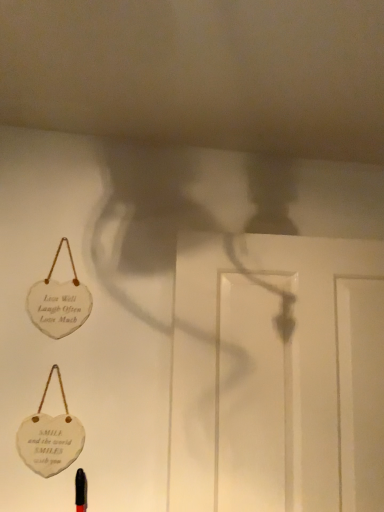
Describe the element at coordinates (58, 306) in the screenshot. I see `white wood heart at upper left` at that location.

At what (x,y) coordinates should I click in order to perform the action: click on white wood heart at upper left. Please return your answer as a coordinate pair (x, y). Looking at the image, I should click on click(x=58, y=306).

The image size is (384, 512). I want to click on white glossy door at center, so click(277, 374).

Image resolution: width=384 pixels, height=512 pixels. What do you see at coordinates (277, 374) in the screenshot?
I see `white glossy door at center` at bounding box center [277, 374].

In order to face white glossy door at center, should I rotate leftwards or rightwards?

It's best to rotate right around 13.168 degrees.

The height and width of the screenshot is (512, 384). I want to click on white wood heart at upper left, so click(58, 306).

Considering the relative positions of white glossy door at center and white wood heart at upper left in the image provided, is white glossy door at center to the left or to the right of white wood heart at upper left?

Clearly, white glossy door at center is on the right of white wood heart at upper left in the image.

Which object is more forward, white glossy door at center or white wood heart at upper left?

white glossy door at center is closer to the camera.

Is point (297, 335) positioned after point (80, 325)?

No, it is not.

From the image's perspective, which one is positioned lower, white glossy door at center or white wood heart at upper left?

white glossy door at center appears lower in the image.

From a real-world perspective, is white glossy door at center physically located above or below white wood heart at upper left?

Clearly, from a real-world perspective, white glossy door at center is below white wood heart at upper left.

Can you confirm if white glossy door at center is thinner than white wood heart at upper left?

No.

Does white glossy door at center have a greater height compared to white wood heart at upper left?

Yes.

Considering the relative sizes of white glossy door at center and white wood heart at upper left in the image provided, is white glossy door at center smaller than white wood heart at upper left?

No, white glossy door at center is not smaller than white wood heart at upper left.

Is white glossy door at center outside of white wood heart at upper left?

Absolutely, white glossy door at center is external to white wood heart at upper left.

Is white glossy door at center far away from white wood heart at upper left?

That's not correct — white glossy door at center is a little close to white wood heart at upper left.

Is white glossy door at center turned away from white wood heart at upper left?

No, white wood heart at upper left is not at the back of white glossy door at center.

Can you tell me how much white glossy door at center and white wood heart at upper left differ in facing direction?

There is a 1.51-degree angle between the facing directions of white glossy door at center and white wood heart at upper left.

How much distance is there between white glossy door at center and white wood heart at upper left?

white glossy door at center is 22.38 inches from white wood heart at upper left.

Locate an element on the screen. This screenshot has height=512, width=384. door beneath the white wood heart at upper left (from a real-world perspective) is located at coordinates (277, 374).

Is white wood heart at upper left at the left side of white glossy door at center?

Correct, you'll find white wood heart at upper left to the left of white glossy door at center.

Considering their positions, is white wood heart at upper left located in front of or behind white glossy door at center?

white wood heart at upper left is positioned farther from the viewer than white glossy door at center.

Which is less distant, (55,303) or (228,395)?

Point (55,303) appears to be farther away from the viewer than point (228,395).

Looking at this image, from the image's perspective, who appears lower, white wood heart at upper left or white glossy door at center?

From the image's view, white glossy door at center is below.

From a real-world perspective, is white wood heart at upper left located beneath white glossy door at center?

Actually, white wood heart at upper left is physically above white glossy door at center in the real world.

In terms of width, does white wood heart at upper left look wider or thinner when compared to white glossy door at center?

Clearly, white wood heart at upper left has less width compared to white glossy door at center.

Which of these two, white wood heart at upper left or white glossy door at center, stands shorter?

With less height is white wood heart at upper left.

Considering the sizes of objects white wood heart at upper left and white glossy door at center in the image provided, who is bigger, white wood heart at upper left or white glossy door at center?

white glossy door at center.

Is white glossy door at center a part of white wood heart at upper left?

Definitely not — white glossy door at center is not inside white wood heart at upper left.

Is white wood heart at upper left next to white glossy door at center and touching it?

white wood heart at upper left and white glossy door at center are not in contact.

Is white wood heart at upper left turned away from white glossy door at center?

white wood heart at upper left does not have its back to white glossy door at center.

Consider the image. How different are the orientations of white wood heart at upper left and white glossy door at center in degrees?

There is a 1.51-degree angle between the facing directions of white wood heart at upper left and white glossy door at center.

Where is `badge above the white glossy door at center (from a real-world perspective)`? The width and height of the screenshot is (384, 512). badge above the white glossy door at center (from a real-world perspective) is located at coordinates (58, 306).

In the image, there is a white wood heart at upper left. Identify the location of door below it (from a real-world perspective). The height and width of the screenshot is (512, 384). (277, 374).

This screenshot has height=512, width=384. I want to click on badge that appears above the white glossy door at center (from the image's perspective), so click(x=58, y=306).